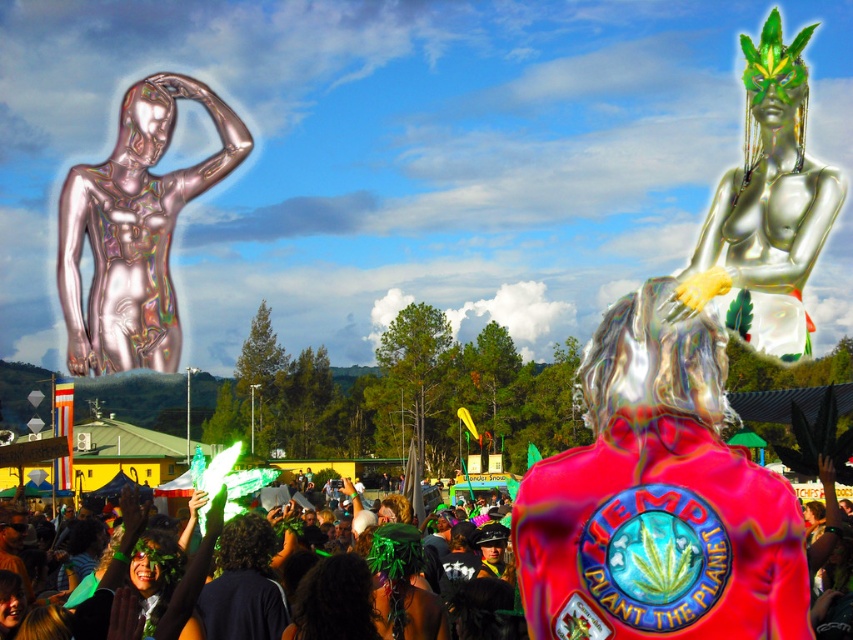
You are a photographer at the festival trying to capture both the holographic metallic statue at upper left and the silver metallic figure at upper right in a single frame. Based on their sizes, which statue should you position closer to the camera to ensure both appear roughly the same height in the photo?

To make both statues appear roughly the same height in the photo, position the holographic metallic statue at upper left closer to the camera since it is taller than the silver metallic figure at upper right. This adjustment will balance their apparent sizes in the frame.

Looking at this image, you are standing at the festival and see two points marked in the image. Which point is closer to you, point (167, 259) or point (804, 44)?

Point (167, 259) is closer to you because it is further to the viewer than point (804, 44).